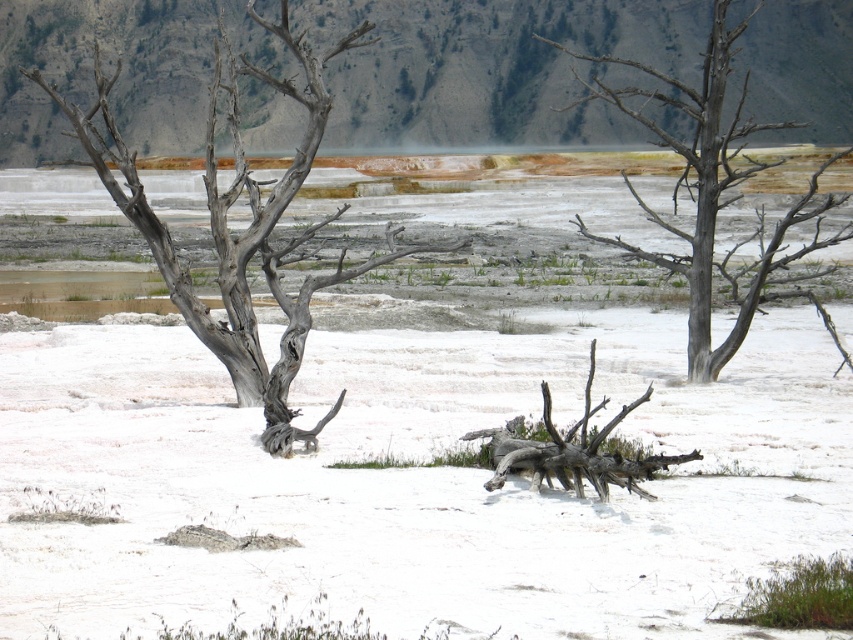
The width and height of the screenshot is (853, 640). Identify the location of gray rough bark tree at left. (244, 228).

Consider the image. Is gray rough bark tree at left to the right of gray bark tree at right from the viewer's perspective?

In fact, gray rough bark tree at left is to the left of gray bark tree at right.

Find the location of `gray rough bark tree at left`. gray rough bark tree at left is located at coordinates (244, 228).

The image size is (853, 640). I want to click on gray rough bark tree at left, so click(244, 228).